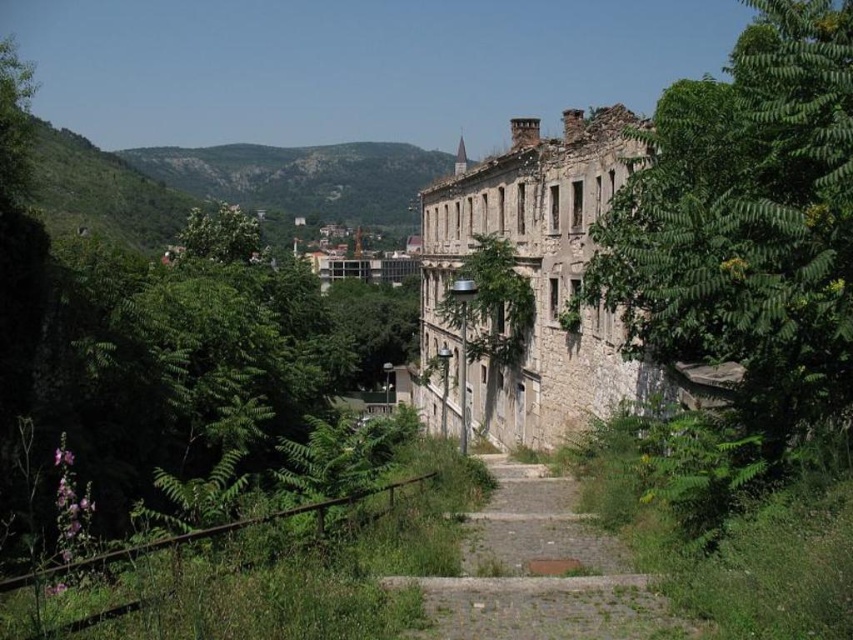
You are a hiker who wants to take a photo of the green leafy tree at right and the dusty stone path at center from a position where both are visible. Considering their sizes, which object should you focus on first to ensure both are in frame?

The green leafy tree at right is larger than the dusty stone path at center, so you should focus on the green leafy tree at right first to ensure it fits within the frame while still capturing the dusty stone path at center.

You are a hiker who wants to take a shortcut from the green leafy tree at right to the green grassy hillside at upper center. Given that your average walking speed is 3 miles per hour, how many minutes would it take to walk this distance?

The distance between the green leafy tree at right and the green grassy hillside at upper center is 2241.96 feet. Converting feet to miles, 2241.96 feet is approximately 0.424 miles. At a walking speed of 3 miles per hour, it would take roughly 8.5 minutes to cover this distance.

You are standing at the entrance of the dilapidated stone building and see the point at coordinates (x=538, y=570). Based on the scene description, where is this point located?

The point at coordinates (x=538, y=570) is on the dusty stone path at center.